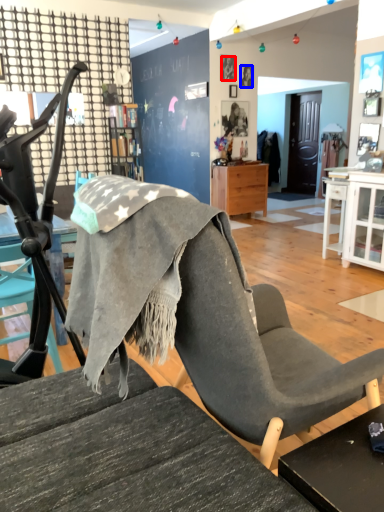
Question: Which point is closer to the camera, person (highlighted by a red box) or person (highlighted by a blue box)?

Choices:
 (A) person
 (B) person

Answer: (A)